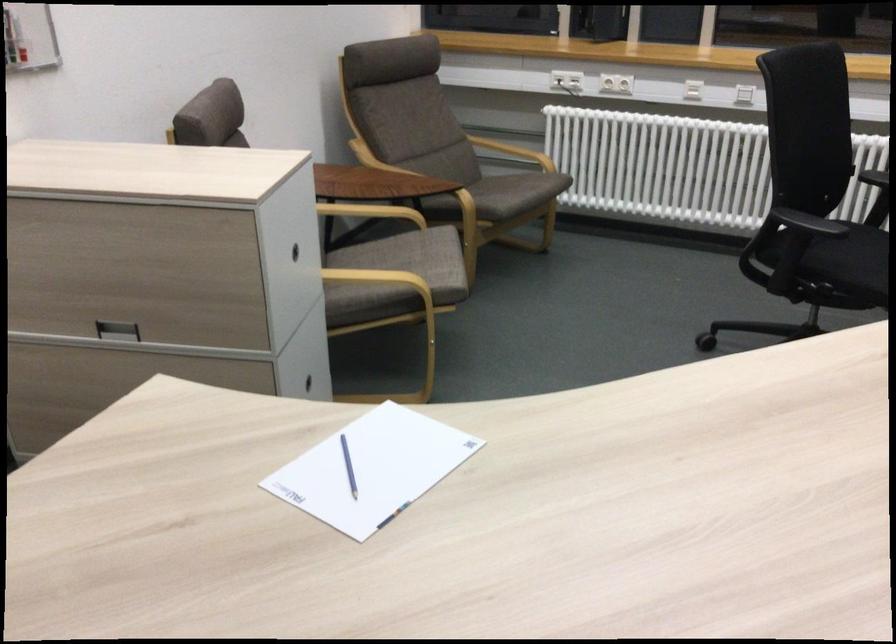
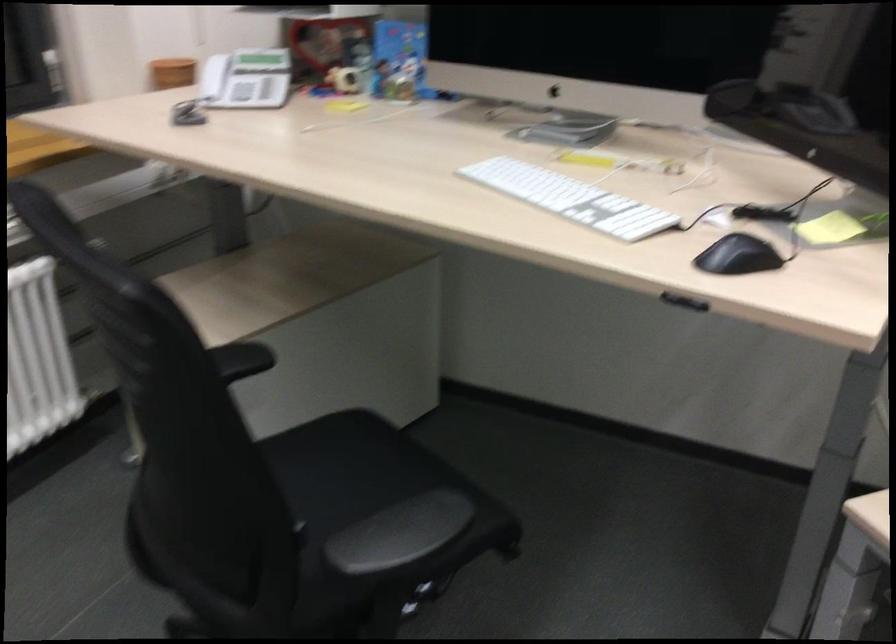
Locate, in the second image, the point that corresponds to pixel 807 223 in the first image.

(400, 534)